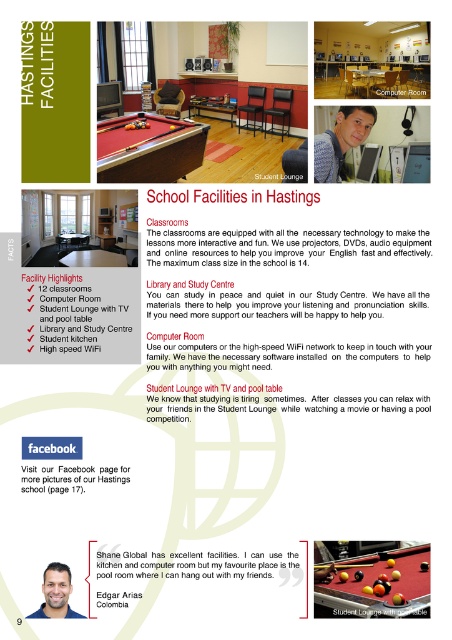
You are designing a new layout for the Hastings Student Lounge and need to place both the yellow felt pool table at center and the red felt pool table at center. Given their sizes, which table should you place closer to the entrance to ensure there is enough space for people to walk around?

The yellow felt pool table at center has a smaller width than the red felt pool table at center, so placing the yellow felt pool table at center closer to the entrance would leave more space for people to walk around the larger red felt pool table at center.